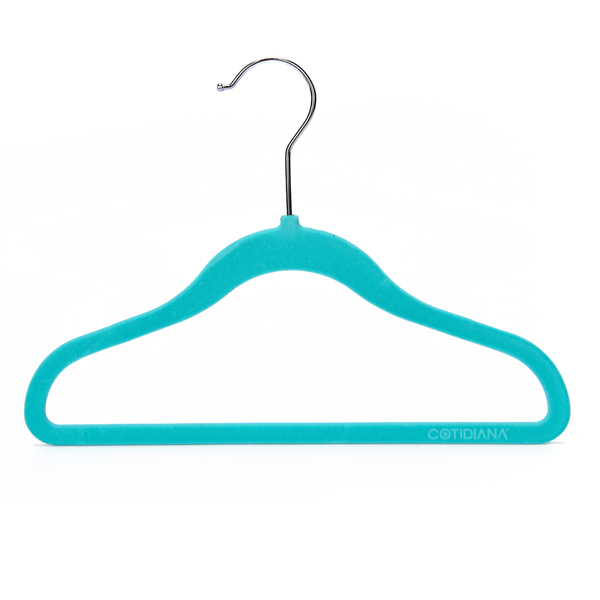
Locate an element on the screen. This screenshot has width=600, height=600. clothes hanger is located at coordinates (339, 256).